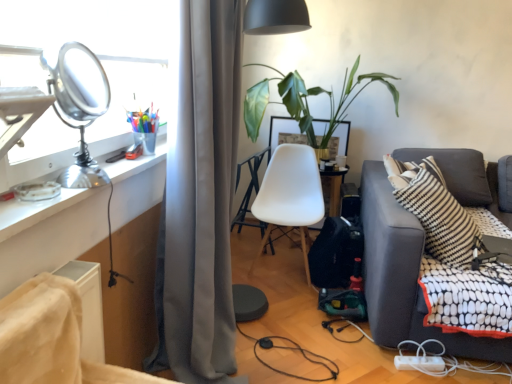
Question: Is dark gray fabric couch at right positioned in front of gray fabric curtain at center?

Choices:
 (A) no
 (B) yes

Answer: (A)

Question: Can you confirm if dark gray fabric couch at right is smaller than gray fabric curtain at center?

Choices:
 (A) yes
 (B) no

Answer: (B)

Question: From the image's perspective, is dark gray fabric couch at right on top of gray fabric curtain at center?

Choices:
 (A) yes
 (B) no

Answer: (B)

Question: Considering the relative sizes of dark gray fabric couch at right and gray fabric curtain at center in the image provided, is dark gray fabric couch at right thinner than gray fabric curtain at center?

Choices:
 (A) no
 (B) yes

Answer: (A)

Question: Is gray fabric curtain at center inside dark gray fabric couch at right?

Choices:
 (A) yes
 (B) no

Answer: (B)

Question: Can you confirm if dark gray fabric couch at right is taller than gray fabric curtain at center?

Choices:
 (A) no
 (B) yes

Answer: (A)

Question: Considering the relative positions of shiny metallic table lamp at upper left and velvet-like beige chair at lower left, marked as the second chair in a right-to-left arrangement, in the image provided, is shiny metallic table lamp at upper left behind velvet-like beige chair at lower left, marked as the second chair in a right-to-left arrangement,?

Choices:
 (A) no
 (B) yes

Answer: (B)

Question: Is shiny metallic table lamp at upper left touching velvet-like beige chair at lower left, marked as the second chair in a right-to-left arrangement?

Choices:
 (A) no
 (B) yes

Answer: (A)

Question: From a real-world perspective, is shiny metallic table lamp at upper left physically below velvet-like beige chair at lower left, arranged as the first chair when viewed from the front?

Choices:
 (A) yes
 (B) no

Answer: (B)

Question: Is shiny metallic table lamp at upper left turned away from velvet-like beige chair at lower left, marked as the second chair in a right-to-left arrangement?

Choices:
 (A) no
 (B) yes

Answer: (A)

Question: Considering the relative sizes of shiny metallic table lamp at upper left and velvet-like beige chair at lower left, the second chair positioned from the back, in the image provided, is shiny metallic table lamp at upper left taller than velvet-like beige chair at lower left, the second chair positioned from the back,?

Choices:
 (A) yes
 (B) no

Answer: (A)

Question: From the image's perspective, would you say shiny metallic table lamp at upper left is shown under velvet-like beige chair at lower left, the second chair positioned from the back?

Choices:
 (A) yes
 (B) no

Answer: (B)

Question: Is velvet-like beige chair at lower left, arranged as the first chair when viewed from the front, completely or partially outside of shiny metallic table lamp at upper left?

Choices:
 (A) yes
 (B) no

Answer: (A)